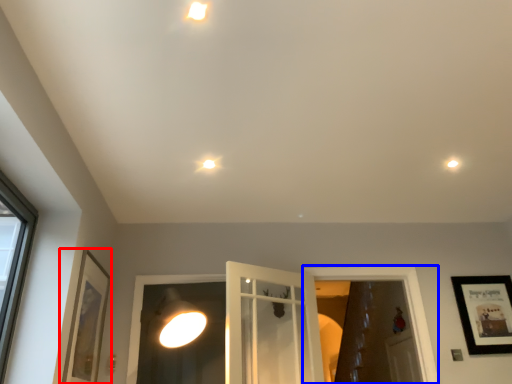
Question: Which of the following is the farthest to the observer, picture frame (highlighted by a red box) or window frame (highlighted by a blue box)?

Choices:
 (A) picture frame
 (B) window frame

Answer: (B)